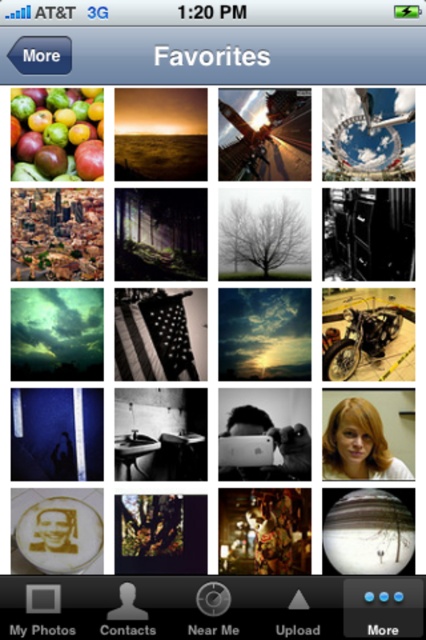
Question: Can you confirm if shiny red apples at upper left is positioned to the left of white matte text at bottom left?

Choices:
 (A) no
 (B) yes

Answer: (B)

Question: Does blonde hair at center lie behind black plastic contacts at bottom?

Choices:
 (A) no
 (B) yes

Answer: (B)

Question: Is blonde hair at center further to the viewer compared to black glossy text at bottom center?

Choices:
 (A) yes
 (B) no

Answer: (A)

Question: Estimate the real-world distances between objects in this image. Which object is closer to the blonde hair at center?

Choices:
 (A) matte white button at bottom center
 (B) shiny chrome motorcycle at center right
 (C) black glossy text at bottom center
 (D) black plastic contacts at bottom

Answer: (B)

Question: Estimate the real-world distances between objects in this image. Which object is farther from the white matte text at bottom left?

Choices:
 (A) shiny chrome motorcycle at center right
 (B) blonde hair at center
 (C) black glossy text at bottom center
 (D) shiny red apples at upper left

Answer: (D)

Question: Which point is closer to the camera?

Choices:
 (A) (402, 304)
 (B) (393, 467)

Answer: (B)